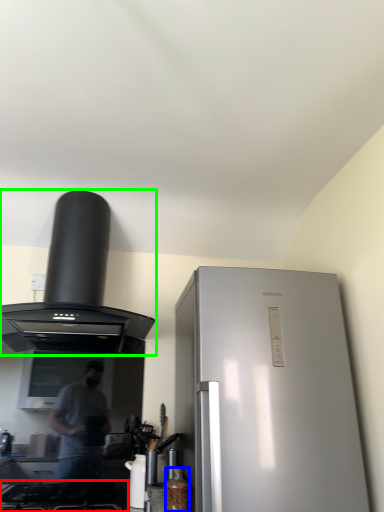
Question: Which object is positioned farthest from gas stove (highlighted by a red box)? Select from bottle (highlighted by a blue box) and kitchen appliance (highlighted by a green box).

Choices:
 (A) bottle
 (B) kitchen appliance

Answer: (B)